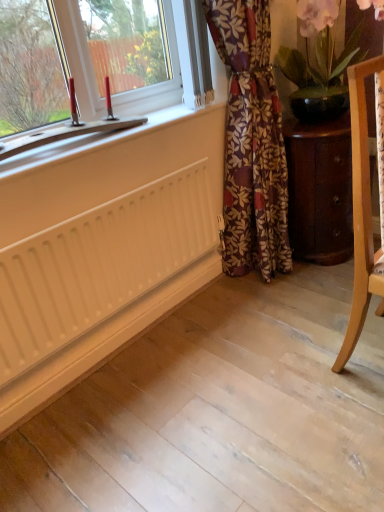
Question: Does light wood chair at right appear on the right side of wooden cabinet at lower right?

Choices:
 (A) yes
 (B) no

Answer: (A)

Question: Does light wood chair at right have a smaller size compared to wooden cabinet at lower right?

Choices:
 (A) no
 (B) yes

Answer: (B)

Question: From the image's perspective, would you say light wood chair at right is shown under wooden cabinet at lower right?

Choices:
 (A) yes
 (B) no

Answer: (A)

Question: Considering the relative sizes of light wood chair at right and wooden cabinet at lower right in the image provided, is light wood chair at right bigger than wooden cabinet at lower right?

Choices:
 (A) no
 (B) yes

Answer: (A)

Question: Would you say wooden cabinet at lower right is part of light wood chair at right's contents?

Choices:
 (A) no
 (B) yes

Answer: (A)

Question: Relative to light wood chair at right, is white matte radiator at lower left in front or behind?

Choices:
 (A) front
 (B) behind

Answer: (B)

Question: Is white matte radiator at lower left to the left or to the right of light wood chair at right in the image?

Choices:
 (A) left
 (B) right

Answer: (A)

Question: Considering the positions of point (26, 371) and point (364, 221), is point (26, 371) closer or farther from the camera than point (364, 221)?

Choices:
 (A) farther
 (B) closer

Answer: (A)

Question: Do you think white matte radiator at lower left is within light wood chair at right, or outside of it?

Choices:
 (A) outside
 (B) inside

Answer: (A)

Question: Visually, is wooden cabinet at lower right positioned to the left or to the right of floral fabric curtain at center?

Choices:
 (A) right
 (B) left

Answer: (A)

Question: From the image's perspective, relative to floral fabric curtain at center, is wooden cabinet at lower right above or below?

Choices:
 (A) below
 (B) above

Answer: (A)

Question: Is wooden cabinet at lower right situated inside floral fabric curtain at center or outside?

Choices:
 (A) inside
 (B) outside

Answer: (B)

Question: Looking at their shapes, would you say wooden cabinet at lower right is wider or thinner than floral fabric curtain at center?

Choices:
 (A) wide
 (B) thin

Answer: (A)

Question: From the image's perspective, is wooden cabinet at lower right located above or below matte black pot at upper right?

Choices:
 (A) below
 (B) above

Answer: (A)

Question: Is point (311, 152) positioned closer to the camera than point (286, 36)?

Choices:
 (A) farther
 (B) closer

Answer: (B)